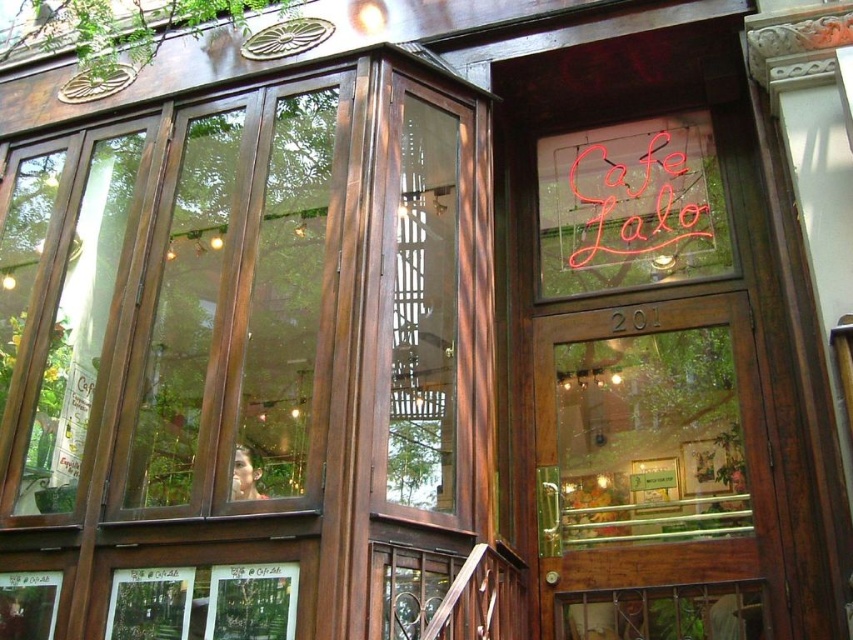
Question: Does wooden door at center have a lesser width compared to wooden sign at center?

Choices:
 (A) no
 (B) yes

Answer: (A)

Question: Does wooden door at center appear on the left side of neon sign at upper right?

Choices:
 (A) yes
 (B) no

Answer: (A)

Question: Which point appears closest to the camera in this image?

Choices:
 (A) (646, 316)
 (B) (624, 193)

Answer: (A)

Question: Which of the following is the farthest from the observer?

Choices:
 (A) (631, 250)
 (B) (550, 595)
 (C) (619, 317)

Answer: (A)

Question: Considering the relative positions of wooden door at center and neon sign at upper right in the image provided, where is wooden door at center located with respect to neon sign at upper right?

Choices:
 (A) above
 (B) below

Answer: (B)

Question: Among these objects, which one is nearest to the camera?

Choices:
 (A) neon sign at upper right
 (B) wooden sign at center

Answer: (B)